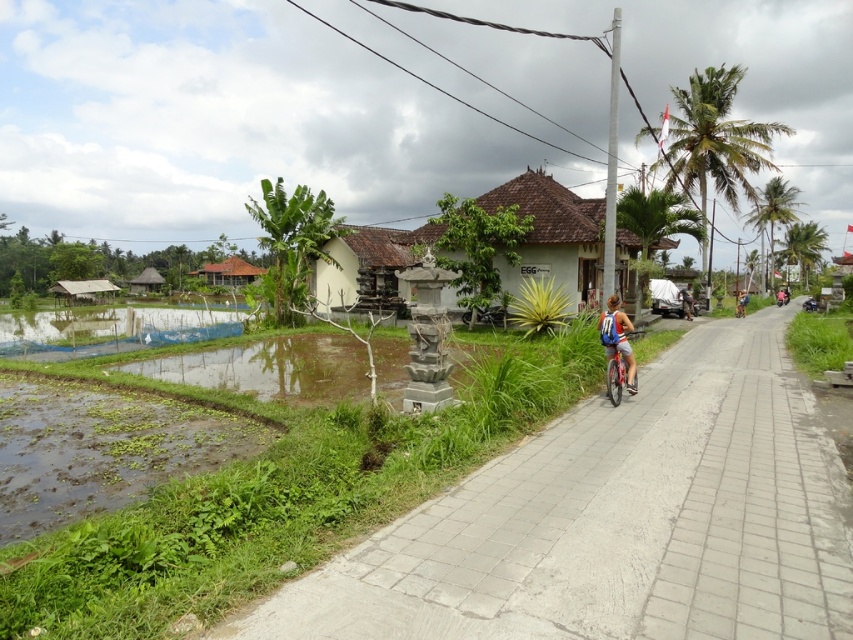
Question: Which point appears closest to the camera in this image?

Choices:
 (A) (134, 289)
 (B) (810, 611)

Answer: (B)

Question: Which point is farther to the camera?

Choices:
 (A) white stucco hut at center
 (B) white stone statue at center
 (C) blue fabric bicycle at center-right
 (D) light brown wooden bicycle at center-right

Answer: (C)

Question: Does brown thatched hut at lower left have a smaller size compared to blue fabric bicycle at center-right?

Choices:
 (A) no
 (B) yes

Answer: (A)

Question: Does thatched straw hut at left appear on the left side of blue fabric bicycle at center-right?

Choices:
 (A) no
 (B) yes

Answer: (B)

Question: Where is white stone statue at center located in relation to light brown wooden bicycle at center-right in the image?

Choices:
 (A) left
 (B) right

Answer: (A)

Question: Which point is farther to the camera?

Choices:
 (A) brown thatched roof hut at left
 (B) brown thatched hut at lower left
 (C) white stucco hut at center

Answer: (A)